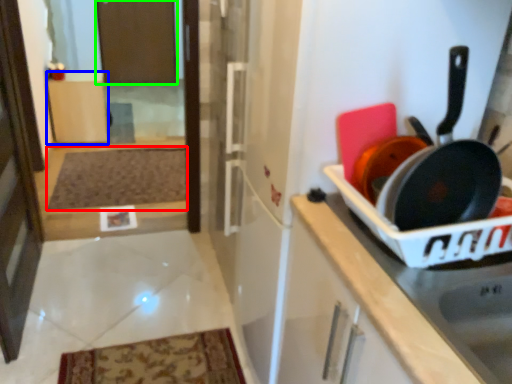
Question: Which object is positioned closest to mat (highlighted by a red box)? Select from cabinetry (highlighted by a blue box) and screen door (highlighted by a green box).

Choices:
 (A) cabinetry
 (B) screen door

Answer: (A)